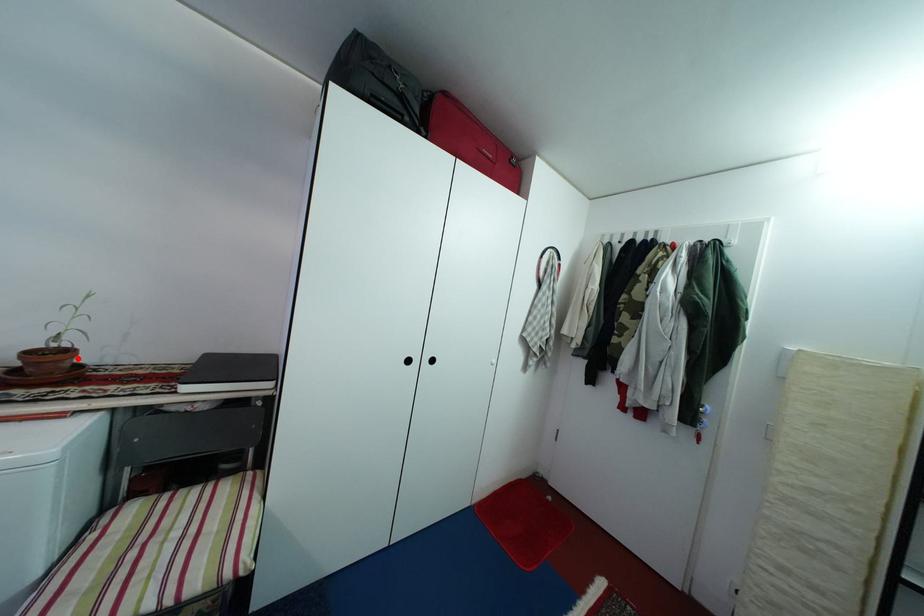
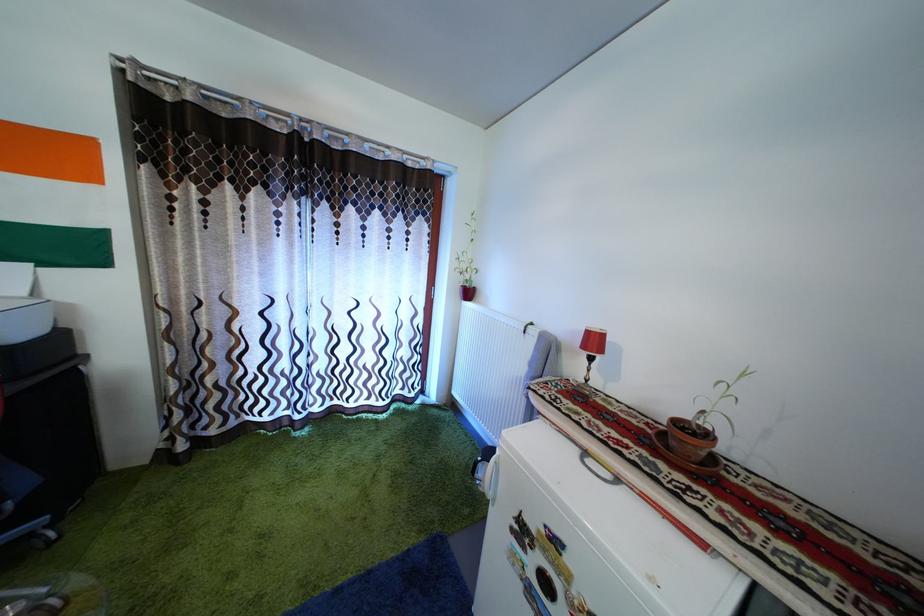
Question: I am providing you with two images of the same scene from different viewpoints. A red point is marked on the first image. Can you still see the location of the red point in image 2?

Choices:
 (A) Yes
 (B) No

Answer: (A)